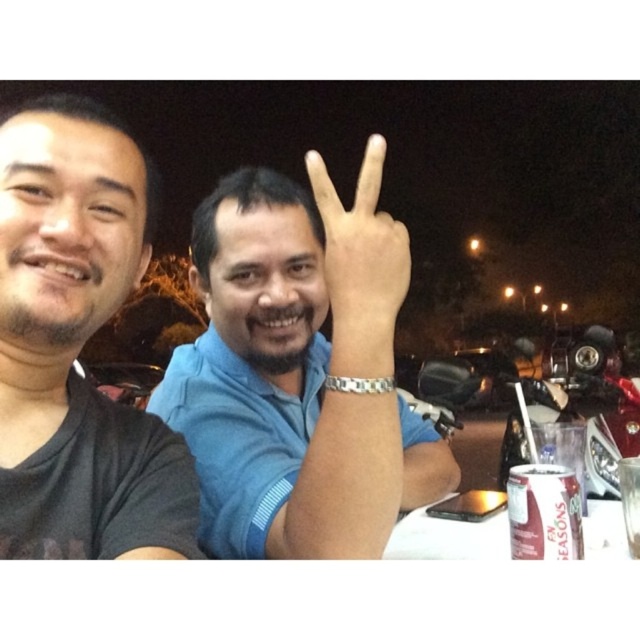
You are a delivery person who needs to place a package between the black matte shirt at left and the metallic silver motorcycle at right. The package requires a minimum of 5 feet of space. Can you fit it there?

The distance between the black matte shirt at left and the metallic silver motorcycle at right is 5.22 feet, which is more than the required 5 feet. Therefore, the package can be placed there.

You are a waiter at the outdoor dining area. You need to place a new order of a salad plate between the blue cotton shirt at center and the white paper table at lower right. Based on their positions, which object should the salad plate be closer to?

The salad plate should be placed closer to the white paper table at lower right because the blue cotton shirt at center is on the left side of it.